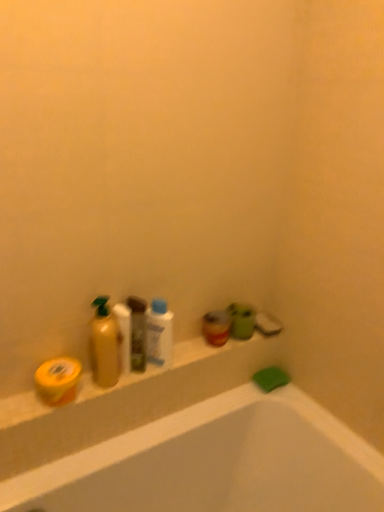
You are a GUI agent. You are given a task and a screenshot of the screen. Output one action in this format:
    pyautogui.click(x=<x>, y=<y>)
    Task: Click on the vacant region above yellow matte container at lower left (from a real-world perspective)
    Image resolution: width=384 pixels, height=512 pixels.
    Given the screenshot: What is the action you would take?
    pyautogui.click(x=170, y=358)